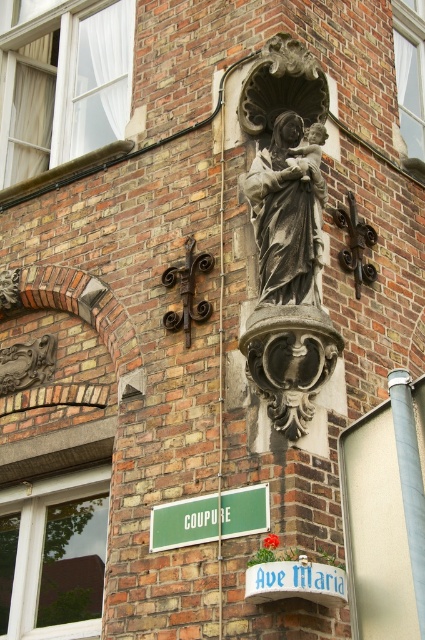
Consider the image. Who is positioned more to the left, gray stone statue at center or green matte sign at lower center?

Positioned to the left is green matte sign at lower center.

Who is more forward, [274,176] or [204,499]?

Point [204,499] is more forward.

What are the coordinates of `gray stone statue at center` in the screenshot? It's located at (289, 211).

Where is `gray stone statue at center`? gray stone statue at center is located at coordinates (289, 211).